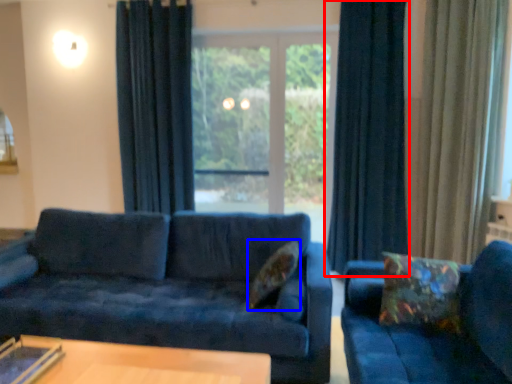
Question: Which object appears closest to the camera in this image, curtain (highlighted by a red box) or pillow (highlighted by a blue box)?

Choices:
 (A) curtain
 (B) pillow

Answer: (B)